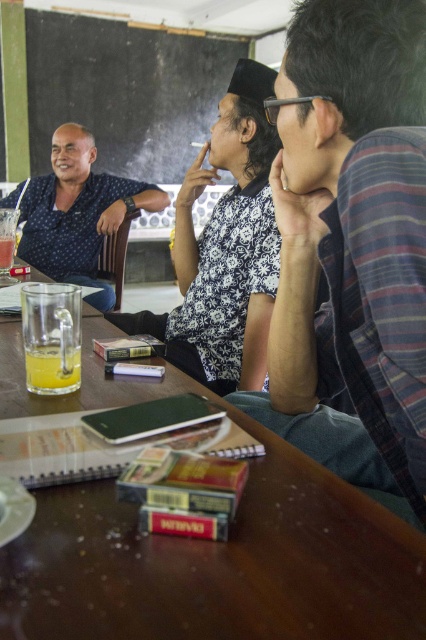
You are standing in the room and want to reach both the point at coordinates (377, 433) and the point at (281, 632). Which point is closer to you?

Point at coordinates (377, 433) is closer to you because it is further to the viewer than point at (281, 632).

You are standing at the edge of the room and see the plaid fabric shirt at center and the brown wooden table at center. Which object is positioned more to the right side of the room?

The plaid fabric shirt at center is positioned more to the right side of the room because it is to the right of the brown wooden table at center, which is also at the center.